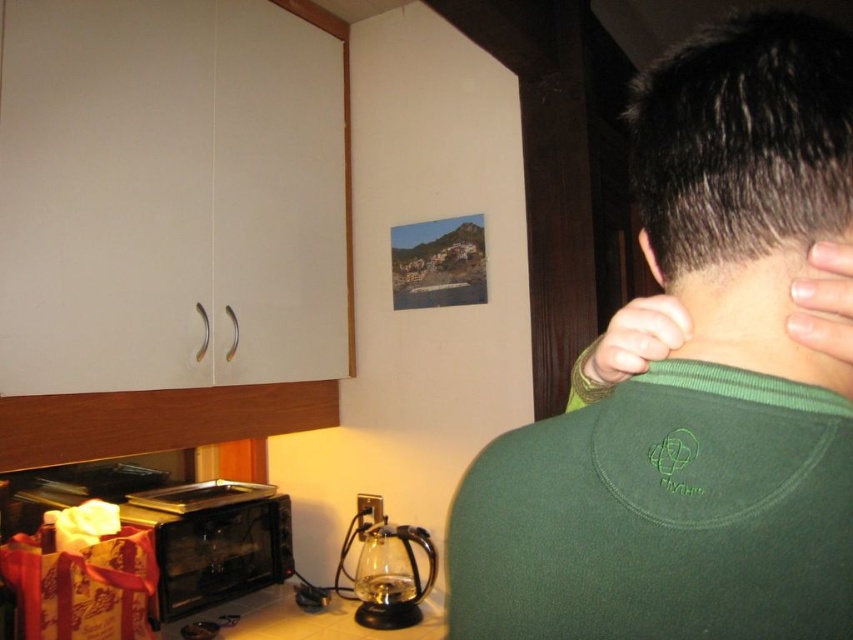
Can you confirm if green fleece sweater at upper right is positioned to the left of pale skin at back?

Yes, green fleece sweater at upper right is to the left of pale skin at back.

What do you see at coordinates (660, 515) in the screenshot?
I see `green fleece sweater at upper right` at bounding box center [660, 515].

Is point (705, 488) positioned after point (821, 248)?

No, it is in front of (821, 248).

Where is `green fleece sweater at upper right`? The width and height of the screenshot is (853, 640). green fleece sweater at upper right is located at coordinates (660, 515).

Who is positioned more to the left, dark brown hair at upper right or green fabric hand at upper right?

green fabric hand at upper right is more to the left.

Based on the photo, is dark brown hair at upper right smaller than green fabric hand at upper right?

No, dark brown hair at upper right is not smaller than green fabric hand at upper right.

Is point (792, 76) behind point (679, 304)?

That is True.

You are a GUI agent. You are given a task and a screenshot of the screen. Output one action in this format:
    pyautogui.click(x=<x>, y=<y>)
    Task: Click on the dark brown hair at upper right
    
    Given the screenshot: What is the action you would take?
    pyautogui.click(x=744, y=164)

Which of these two, green fleece sweater at upper right or green matte neck at center, stands shorter?

With less height is green matte neck at center.

Does point (639, 618) come behind point (798, 344)?

No, (639, 618) is closer to viewer.

Locate an element on the screen. The width and height of the screenshot is (853, 640). green fleece sweater at upper right is located at coordinates (660, 515).